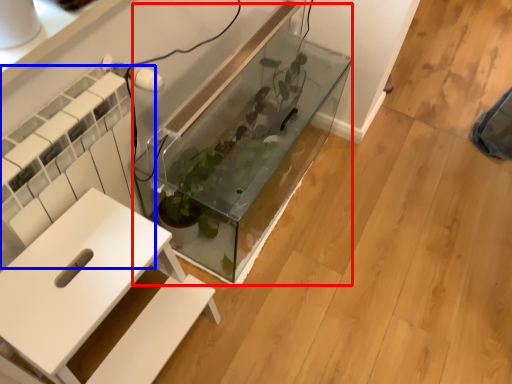
Question: Which point is further to the camera, glass box (highlighted by a red box) or radiator (highlighted by a blue box)?

Choices:
 (A) glass box
 (B) radiator

Answer: (A)